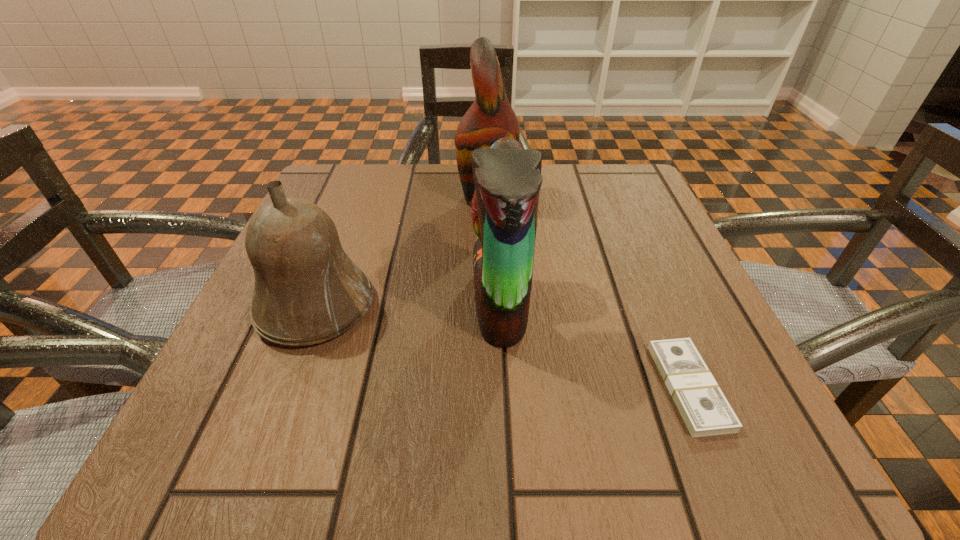
Locate an element on the screen. the farther parrot is located at coordinates (491, 117).

This screenshot has height=540, width=960. In order to click on the third shortest object in this screenshot , I will do `click(507, 178)`.

The image size is (960, 540). What are the coordinates of `the shorter parrot` in the screenshot? It's located at (507, 178).

Locate an element on the screen. the leftmost object is located at coordinates (307, 290).

At what (x,y) coordinates should I click in order to perform the action: click on bell. Please return your answer as a coordinate pair (x, y). Looking at the image, I should click on (307, 290).

Locate an element on the screen. This screenshot has width=960, height=540. the rightmost object is located at coordinates (703, 407).

Locate an element on the screen. dollar is located at coordinates (703, 407).

Where is `blank area located on the face of the farthest object`? blank area located on the face of the farthest object is located at coordinates (356, 198).

I want to click on free spot located on the face of the farthest object, so click(x=434, y=198).

This screenshot has width=960, height=540. I want to click on vacant region located 0.100m on the face of the farthest object, so click(x=411, y=198).